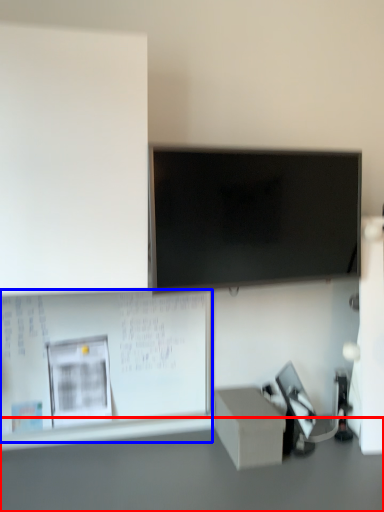
Question: Which object is closer to the camera taking this photo, table (highlighted by a red box) or bulletin board (highlighted by a blue box)?

Choices:
 (A) table
 (B) bulletin board

Answer: (A)